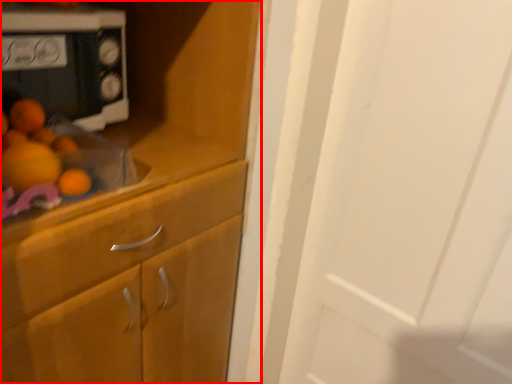
Question: In this image, where is cabinetry (annotated by the red box) located relative to home appliance?

Choices:
 (A) right
 (B) left

Answer: (B)